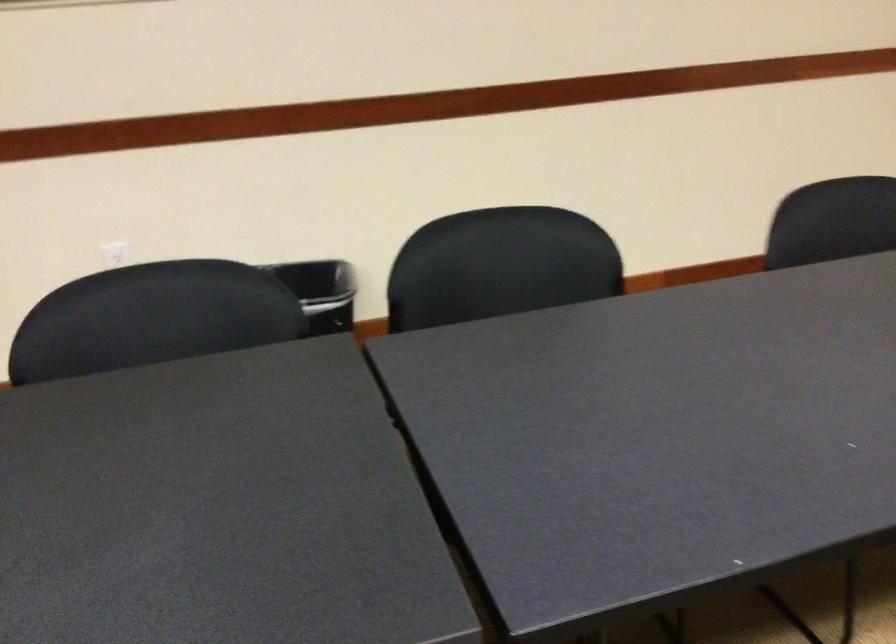
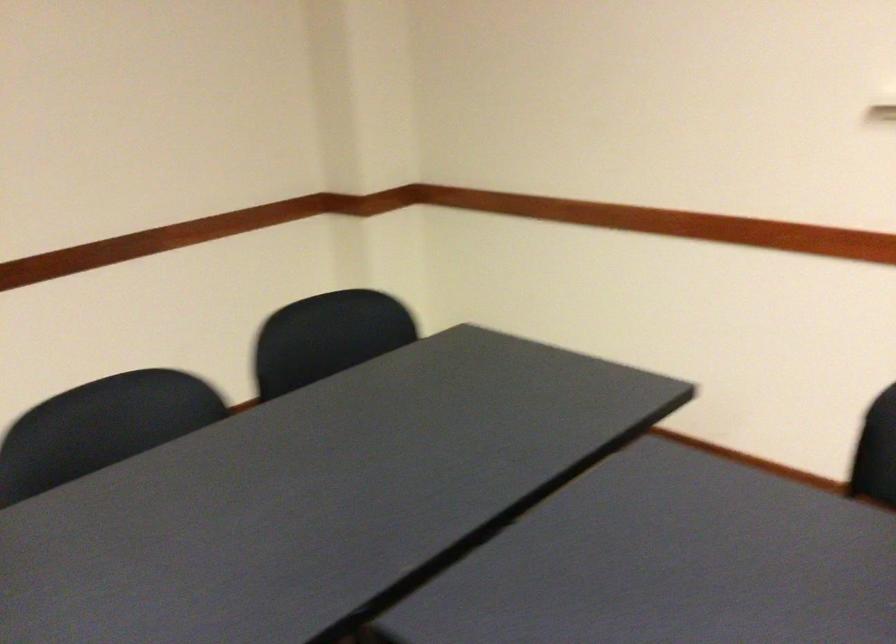
Question: The images are taken continuously from a first-person perspective. In which direction are you moving?

Choices:
 (A) Left
 (B) Right
 (C) Forward
 (D) Backward

Answer: (B)